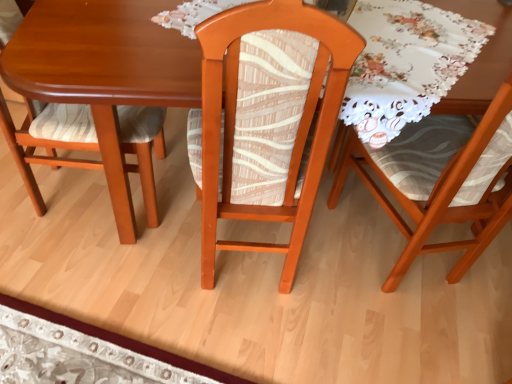
Where is `free point below matte wood chair at left, the 1th chair in the left-to-right sequence (from a real-world perspective)`? free point below matte wood chair at left, the 1th chair in the left-to-right sequence (from a real-world perspective) is located at coordinates (86, 197).